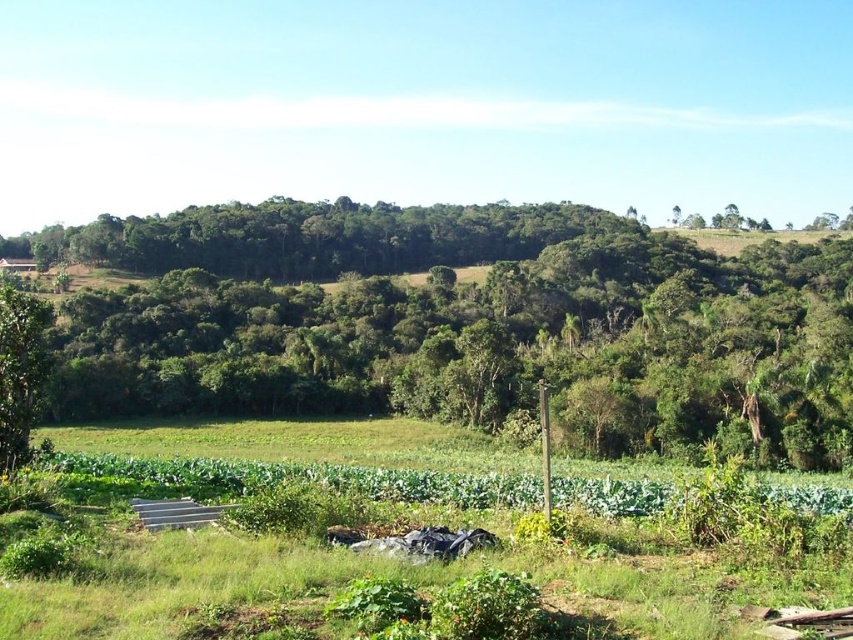
You are standing at the center of the image and want to locate the green leafy tree at center. What are its coordinates?

The green leafy tree at center is located at coordinates point (467, 324).

You are standing at the point closer to the camera in the image. Which point are you at, point (151, 353) or point (30, 296)?

You are at point (30, 296) because it is closer to the camera than point (151, 353).